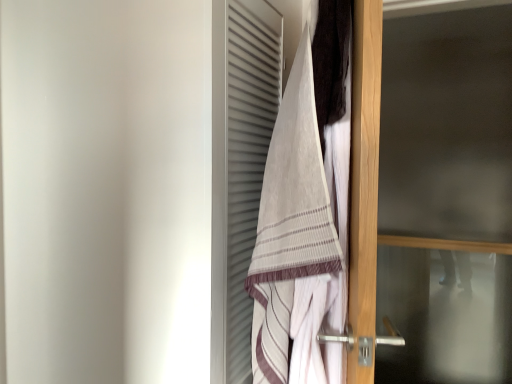
Identify the location of striped cotton towel at center. This screenshot has height=384, width=512. (301, 235).

Would you consider dark brown towel at upper right to be distant from striped cotton towel at center?

They are positioned close to each other.

From the image's perspective, which one is positioned higher, dark brown towel at upper right or striped cotton towel at center?

dark brown towel at upper right, from the image's perspective.

Considering the sizes of objects dark brown towel at upper right and striped cotton towel at center in the image provided, who is smaller, dark brown towel at upper right or striped cotton towel at center?

Smaller between the two is dark brown towel at upper right.

Is striped cotton towel at center inside dark brown towel at upper right?

Actually, striped cotton towel at center is outside dark brown towel at upper right.

From the image's perspective, between transparent glass screen door at right and dark brown towel at upper right, which one is located above?

dark brown towel at upper right appears higher in the image.

Would you say transparent glass screen door at right is a long distance from dark brown towel at upper right?

transparent glass screen door at right is far away from dark brown towel at upper right.

Which object is thinner, transparent glass screen door at right or dark brown towel at upper right?

Thinner between the two is dark brown towel at upper right.

Is transparent glass screen door at right thinner than striped cotton towel at center?

Yes.

In the image, is transparent glass screen door at right on the left side or the right side of striped cotton towel at center?

Clearly, transparent glass screen door at right is on the right of striped cotton towel at center in the image.

Is transparent glass screen door at right further to camera compared to striped cotton towel at center?

Yes, it is.

Is transparent glass screen door at right far from striped cotton towel at center?

Yes, transparent glass screen door at right and striped cotton towel at center are quite far apart.

From the image's perspective, would you say striped cotton towel at center is shown under transparent glass screen door at right?

Yes, from the image's perspective, striped cotton towel at center is below transparent glass screen door at right.

Who is shorter, striped cotton towel at center or transparent glass screen door at right?

With less height is striped cotton towel at center.

From a real-world perspective, is striped cotton towel at center positioned under transparent glass screen door at right based on gravity?

Yes, from a real-world perspective, striped cotton towel at center is beneath transparent glass screen door at right.

Is the surface of striped cotton towel at center in direct contact with transparent glass screen door at right?

No, striped cotton towel at center is not beside transparent glass screen door at right.

Considering the positions of points (319, 123) and (436, 140), is point (319, 123) closer to camera compared to point (436, 140)?

Yes, point (319, 123) is closer to viewer.

Based on the photo, which of these two, dark brown towel at upper right or transparent glass screen door at right, stands taller?

transparent glass screen door at right is taller.

Which of these two, dark brown towel at upper right or transparent glass screen door at right, is thinner?

With smaller width is dark brown towel at upper right.

This screenshot has width=512, height=384. What are the coordinates of `screen door to the right of dark brown towel at upper right` in the screenshot? It's located at (446, 197).

From the image's perspective, which one is positioned higher, striped cotton towel at center or dark brown towel at upper right?

dark brown towel at upper right, from the image's perspective.

Which of these two, striped cotton towel at center or dark brown towel at upper right, stands shorter?

dark brown towel at upper right is shorter.

From a real-world perspective, is striped cotton towel at center under dark brown towel at upper right?

Indeed, from a real-world perspective, striped cotton towel at center is positioned beneath dark brown towel at upper right.

Is dark brown towel at upper right a part of striped cotton towel at center?

Yes, striped cotton towel at center is surrounding dark brown towel at upper right.

Locate an element on the screen. This screenshot has width=512, height=384. hair on the right side of striped cotton towel at center is located at coordinates click(x=331, y=61).

Where is `hair above the transparent glass screen door at right (from the image's perspective)`? Image resolution: width=512 pixels, height=384 pixels. hair above the transparent glass screen door at right (from the image's perspective) is located at coordinates (331, 61).

Considering their positions, is transparent glass screen door at right positioned closer to striped cotton towel at center than dark brown towel at upper right?

dark brown towel at upper right.

Looking at the image, which one is located further to striped cotton towel at center, dark brown towel at upper right or transparent glass screen door at right?

Based on the image, transparent glass screen door at right appears to be further to striped cotton towel at center.

Estimate the real-world distances between objects in this image. Which object is closer to dark brown towel at upper right, striped cotton towel at center or transparent glass screen door at right?

Based on the image, striped cotton towel at center appears to be nearer to dark brown towel at upper right.

Looking at the image, which one is located further to transparent glass screen door at right, dark brown towel at upper right or striped cotton towel at center?

dark brown towel at upper right is further to transparent glass screen door at right.

Considering their positions, is transparent glass screen door at right positioned closer to dark brown towel at upper right than striped cotton towel at center?

striped cotton towel at center is closer to dark brown towel at upper right.

When comparing their distances from transparent glass screen door at right, does striped cotton towel at center or dark brown towel at upper right seem further?

The object further to transparent glass screen door at right is dark brown towel at upper right.

Locate an element on the screen. Image resolution: width=512 pixels, height=384 pixels. hair situated between striped cotton towel at center and transparent glass screen door at right from left to right is located at coordinates (331, 61).